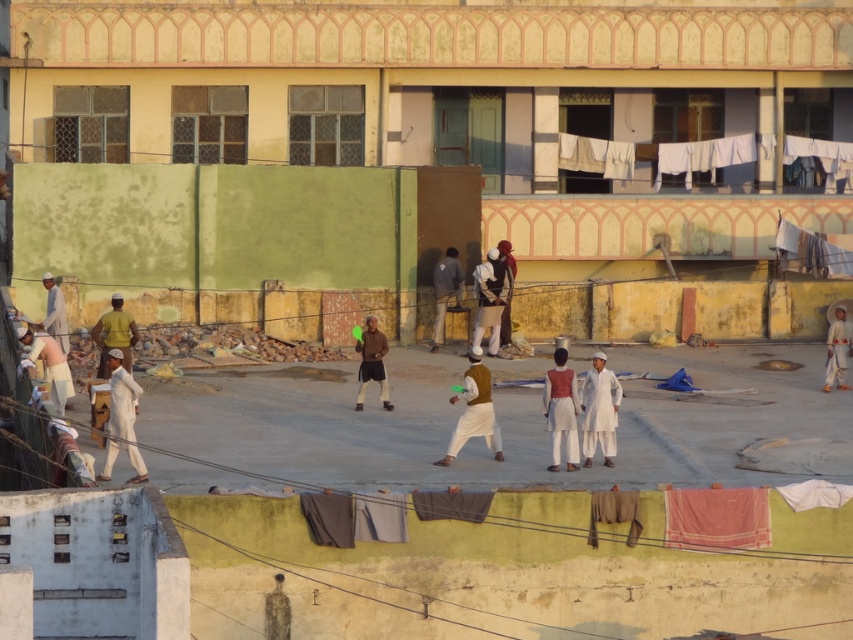
Can you confirm if white cotton pants at left is smaller than dark gray fabric at center?

Actually, white cotton pants at left might be larger than dark gray fabric at center.

Identify the location of white cotton pants at left. The image size is (853, 640). (120, 419).

The image size is (853, 640). Identify the location of white cotton pants at left. (120, 419).

Who is positioned more to the left, white cotton kurta at center or brown leather jacket at center?

brown leather jacket at center is more to the left.

Does white cotton kurta at center lie behind brown leather jacket at center?

That is False.

This screenshot has height=640, width=853. Find the location of `white cotton kurta at center`. white cotton kurta at center is located at coordinates (561, 412).

Where is `white cotton kurta at center`? white cotton kurta at center is located at coordinates (561, 412).

Who is lower down, light beige fabric at lower left or yellow fabric at center?

light beige fabric at lower left

Is light beige fabric at lower left to the right of yellow fabric at center from the viewer's perspective?

No, light beige fabric at lower left is not to the right of yellow fabric at center.

This screenshot has width=853, height=640. Find the location of `light beige fabric at lower left`. light beige fabric at lower left is located at coordinates tap(48, 364).